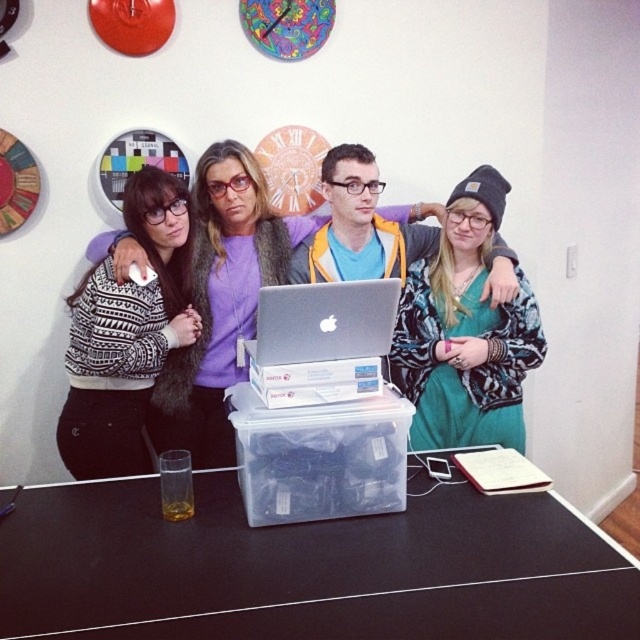
Question: Which is nearer to the black plastic table at center?

Choices:
 (A) black knit beanie at upper right
 (B) white printed sweater at left

Answer: (A)

Question: Which object is the closest to the black plastic table at center?

Choices:
 (A) silver metallic laptop at center
 (B) white printed sweater at left

Answer: (A)

Question: Estimate the real-world distances between objects in this image. Which object is farther from the black knit beanie at upper right?

Choices:
 (A) white printed sweater at left
 (B) black plastic table at center
 (C) silver metallic laptop at center

Answer: (A)

Question: Is black plastic table at center further to the viewer compared to black knit beanie at upper right?

Choices:
 (A) no
 (B) yes

Answer: (A)

Question: Is black knit beanie at upper right bigger than silver metallic laptop at center?

Choices:
 (A) no
 (B) yes

Answer: (B)

Question: Can you confirm if white printed sweater at left is thinner than silver metallic laptop at center?

Choices:
 (A) no
 (B) yes

Answer: (A)